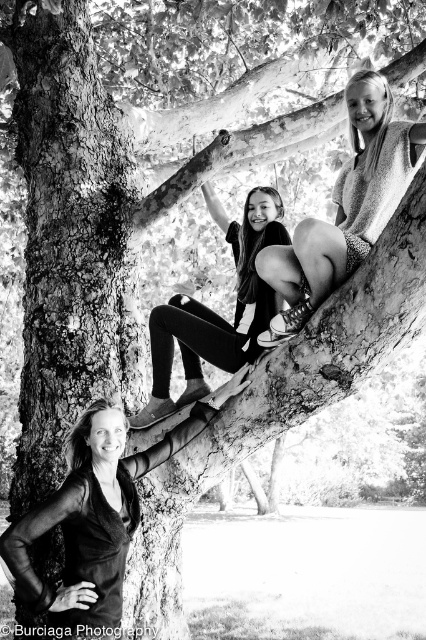
Who is higher up, matte black leggings at upper center or matte black leggings at center?

Positioned higher is matte black leggings at upper center.

Based on the photo, which of these two, matte black leggings at upper center or matte black leggings at center, stands shorter?

matte black leggings at upper center

Between point (374, 173) and point (250, 252), which one is positioned in front?

Point (374, 173)

I want to click on matte black leggings at upper center, so click(x=345, y=208).

The height and width of the screenshot is (640, 426). I want to click on smooth black dress at lower left, so click(83, 528).

Can you confirm if smooth black dress at lower left is bigger than matte black leggings at center?

Actually, smooth black dress at lower left might be smaller than matte black leggings at center.

At what (x,y) coordinates should I click in order to perform the action: click on smooth black dress at lower left. Please return your answer as a coordinate pair (x, y). The width and height of the screenshot is (426, 640). Looking at the image, I should click on (83, 528).

Find the location of a particular element. The width and height of the screenshot is (426, 640). smooth black dress at lower left is located at coordinates (83, 528).

Which is above, smooth black dress at lower left or matte black leggings at upper center?

Positioned higher is matte black leggings at upper center.

Which is behind, point (23, 577) or point (408, 122)?

Positioned behind is point (408, 122).

This screenshot has height=640, width=426. Describe the element at coordinates (83, 528) in the screenshot. I see `smooth black dress at lower left` at that location.

Where is `smooth black dress at lower left`? smooth black dress at lower left is located at coordinates (83, 528).